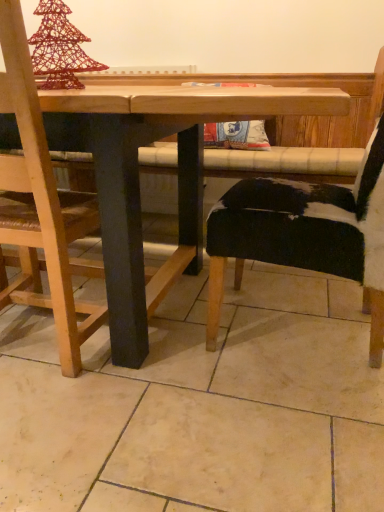
In order to click on vacant point to the right of wooden chair at left, the 2th chair viewed from the right in this screenshot , I will do `click(167, 349)`.